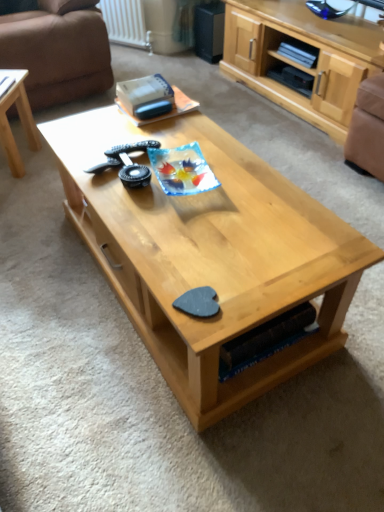
Locate an element on the screen. The height and width of the screenshot is (512, 384). vacant area that lies in front of natural wood coffee table at center, which is the 2th coffee table in left-to-right order is located at coordinates (175, 425).